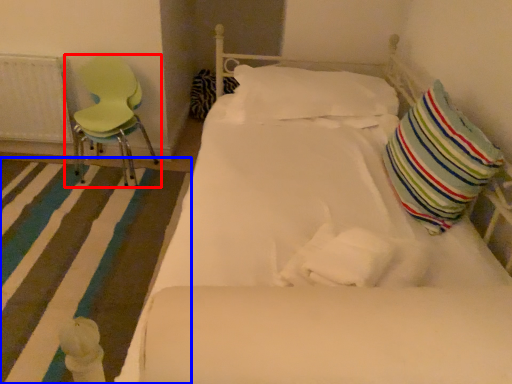
Question: Which point is closer to the camera, chair (highlighted by a red box) or strip (highlighted by a blue box)?

Choices:
 (A) chair
 (B) strip

Answer: (B)